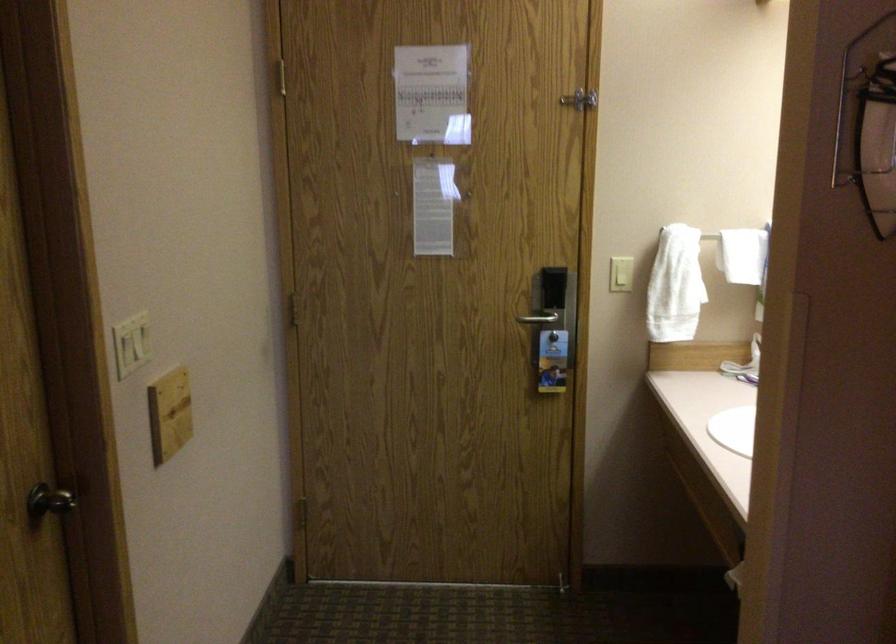
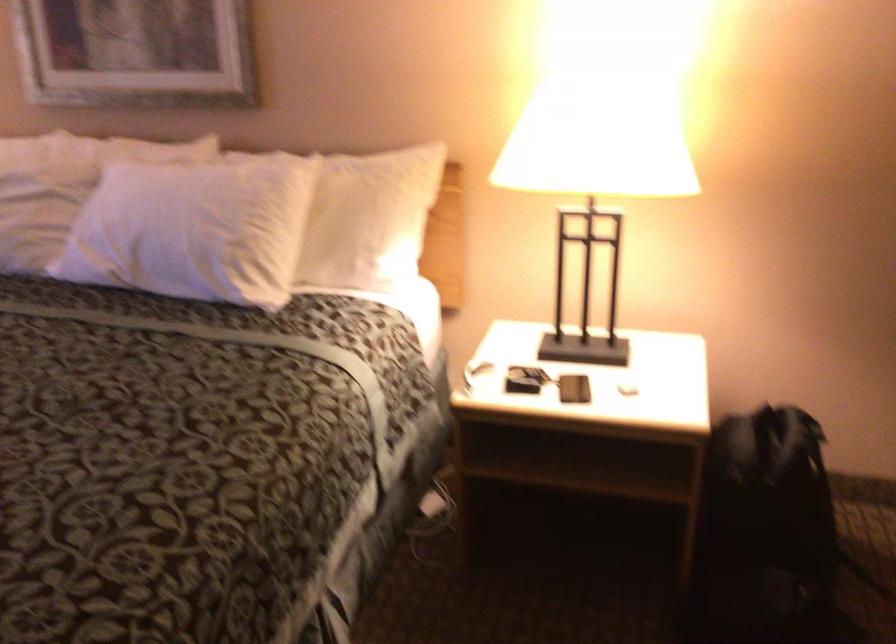
How did the camera likely rotate?

The camera's rotation is toward left-down.